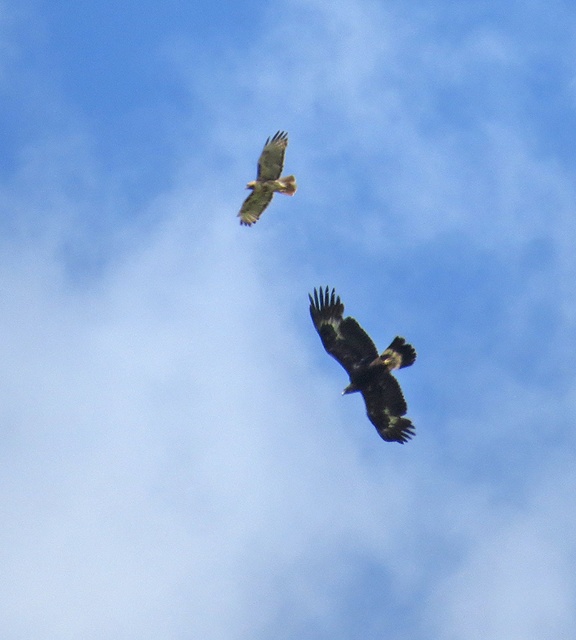
Question: Which point is closer to the camera taking this photo?

Choices:
 (A) (289, 188)
 (B) (369, 349)

Answer: (B)

Question: Is dark brown feathers at center thinner than brown feathered eagle at upper center?

Choices:
 (A) yes
 (B) no

Answer: (B)

Question: From the image, what is the correct spatial relationship of dark brown feathers at center in relation to brown feathered eagle at upper center?

Choices:
 (A) below
 (B) above

Answer: (A)

Question: Can you confirm if dark brown feathers at center is smaller than brown feathered eagle at upper center?

Choices:
 (A) yes
 (B) no

Answer: (B)